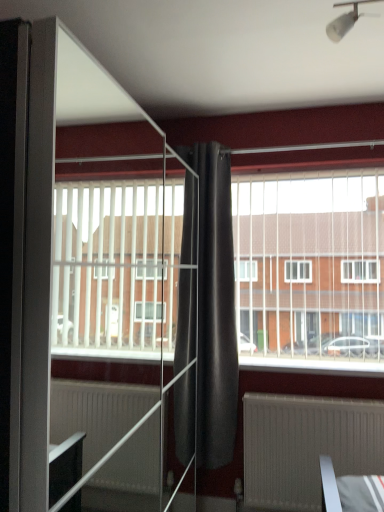
Question: Considering the positions of white plastic light fixture at upper center and dark matte curtain at center in the image, is white plastic light fixture at upper center taller or shorter than dark matte curtain at center?

Choices:
 (A) tall
 (B) short

Answer: (B)

Question: Is white plastic light fixture at upper center spatially inside dark matte curtain at center, or outside of it?

Choices:
 (A) outside
 (B) inside

Answer: (A)

Question: Based on their relative distances, which object is farther from the transparent glass screen door at center?

Choices:
 (A) matte gray radiator at lower center
 (B) white plastic light fixture at upper center
 (C) white plastic blinds at center
 (D) dark matte curtain at center

Answer: (B)

Question: Which object is positioned farthest from the white plastic blinds at center?

Choices:
 (A) matte gray radiator at lower center
 (B) white plastic light fixture at upper center
 (C) transparent glass screen door at center
 (D) dark matte curtain at center

Answer: (B)